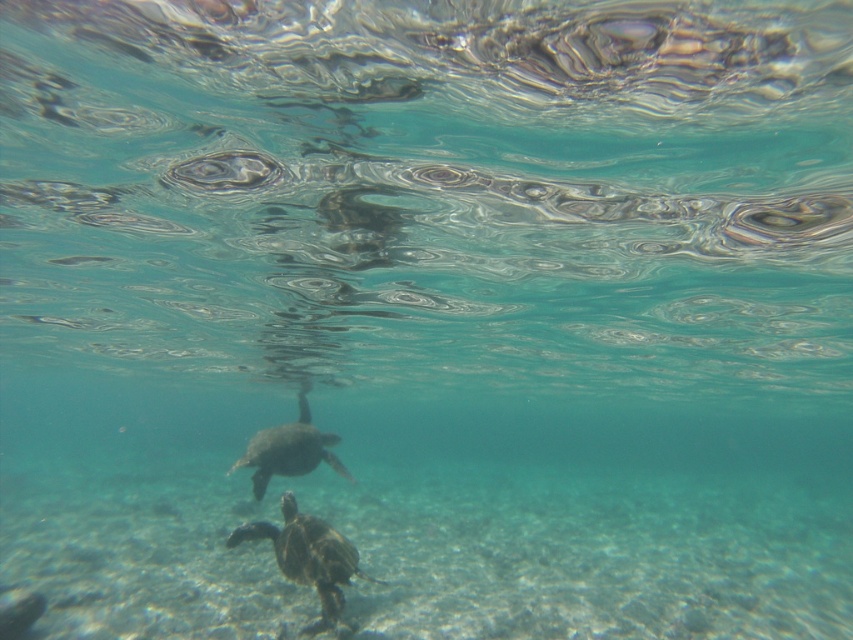
Who is positioned more to the left, green textured shell at center or smooth gray turtle at center?

smooth gray turtle at center is more to the left.

Is the position of green textured shell at center less distant than that of smooth gray turtle at center?

Yes, it is in front of smooth gray turtle at center.

Image resolution: width=853 pixels, height=640 pixels. I want to click on green textured shell at center, so click(308, 557).